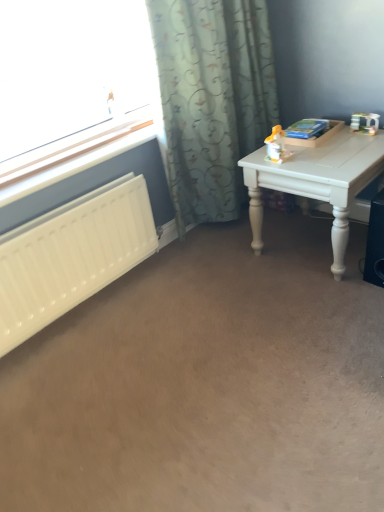
Where is `free spot above white painted wood table at right (from a real-world perspective)`? free spot above white painted wood table at right (from a real-world perspective) is located at coordinates (331, 148).